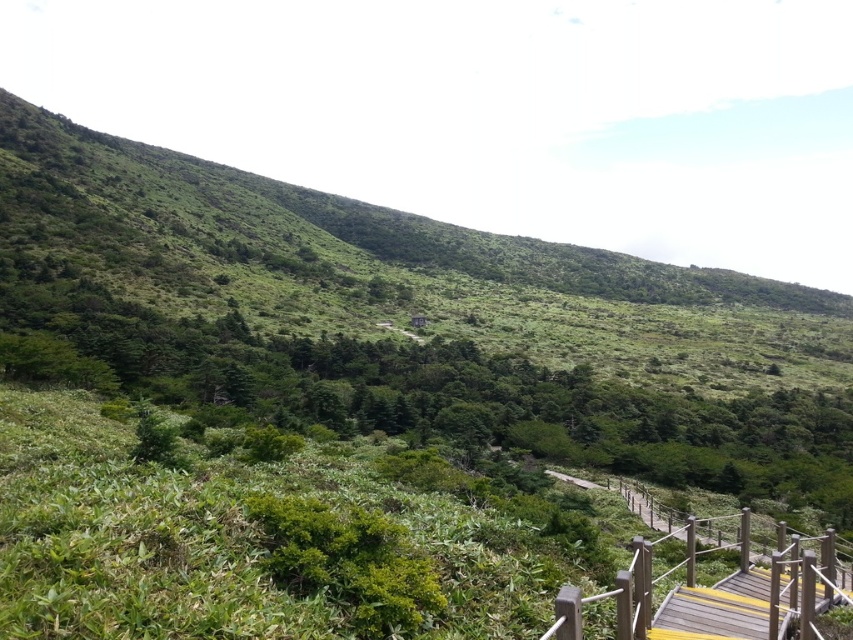
Question: Is wooden rail at lower right above yellow painted wood at lower right?

Choices:
 (A) yes
 (B) no

Answer: (B)

Question: Which of the following is the farthest from the observer?

Choices:
 (A) (763, 609)
 (B) (685, 532)

Answer: (B)

Question: Does wooden rail at lower right appear under yellow painted wood at lower right?

Choices:
 (A) no
 (B) yes

Answer: (B)

Question: Which of the following is the closest to the observer?

Choices:
 (A) (708, 618)
 (B) (735, 595)

Answer: (A)

Question: Is wooden rail at lower right to the left of yellow painted wood at lower right from the viewer's perspective?

Choices:
 (A) yes
 (B) no

Answer: (B)

Question: Which of the following is the farthest from the observer?

Choices:
 (A) yellow painted wood at lower right
 (B) wooden rail at lower right

Answer: (A)